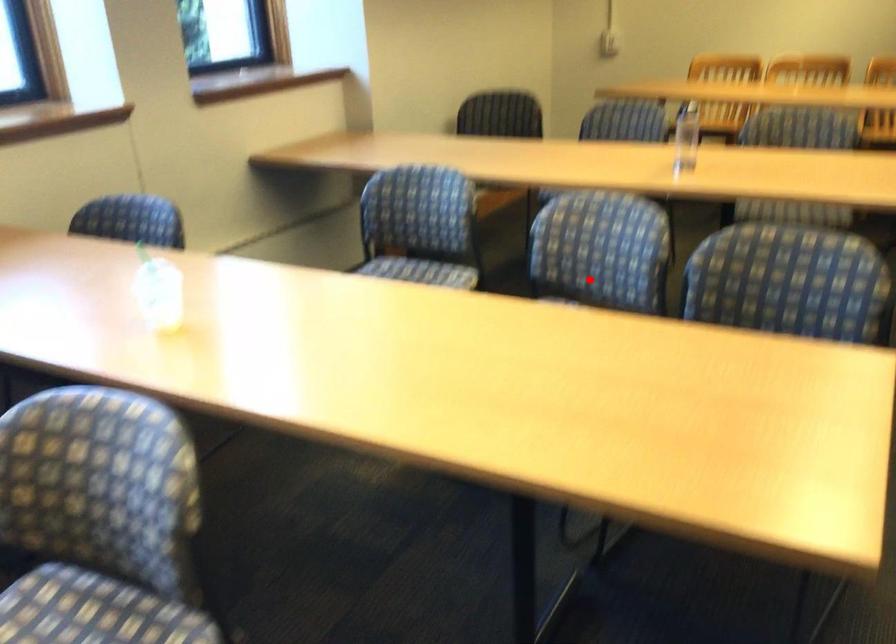
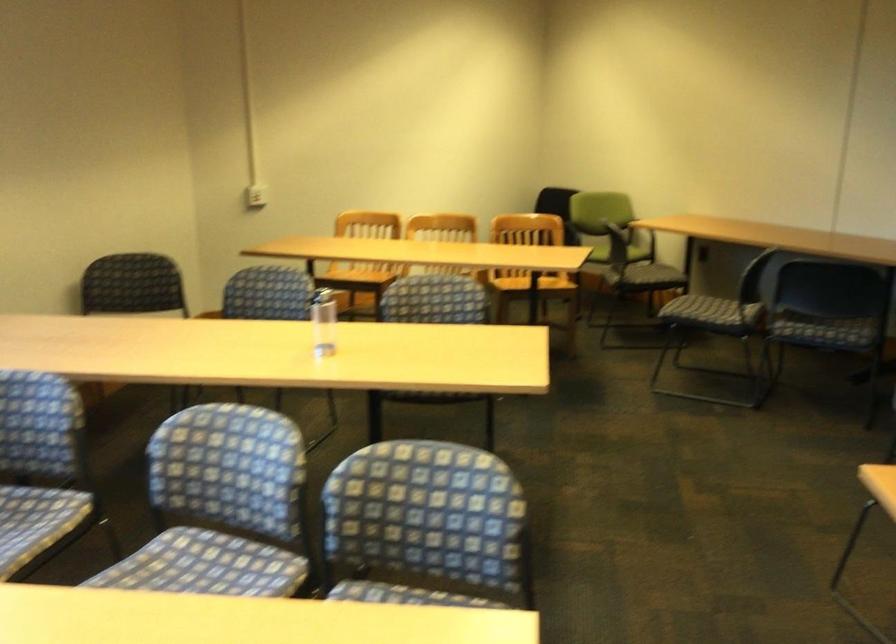
Locate, in the second image, the point that corresponds to the highlighted location in the first image.

(221, 506)